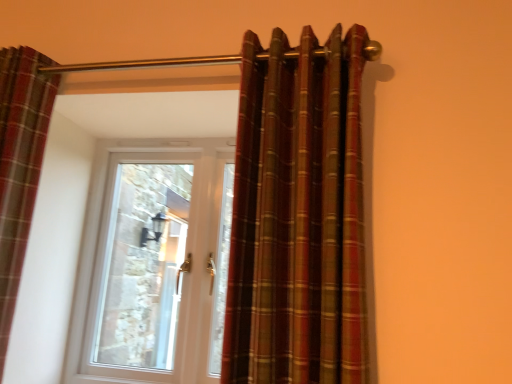
Question: Which direction should I rotate to look at plaid fabric curtain at center, the 2th curtain in the left-to-right sequence?

Choices:
 (A) left
 (B) right

Answer: (B)

Question: Is plaid fabric curtain at center, positioned as the 1th curtain in right-to-left order, aimed at plaid fabric curtain at left, which is counted as the first curtain, starting from the left?

Choices:
 (A) yes
 (B) no

Answer: (B)

Question: Considering the relative sizes of plaid fabric curtain at center, positioned as the 1th curtain in right-to-left order, and plaid fabric curtain at left, which ranks as the second curtain in right-to-left order, in the image provided, is plaid fabric curtain at center, positioned as the 1th curtain in right-to-left order, shorter than plaid fabric curtain at left, which ranks as the second curtain in right-to-left order,?

Choices:
 (A) no
 (B) yes

Answer: (B)

Question: Is plaid fabric curtain at center, the 2th curtain in the left-to-right sequence, at the right side of plaid fabric curtain at left, which ranks as the second curtain in right-to-left order?

Choices:
 (A) yes
 (B) no

Answer: (A)

Question: Does plaid fabric curtain at center, the 2th curtain in the left-to-right sequence, have a smaller size compared to plaid fabric curtain at left, which ranks as the second curtain in right-to-left order?

Choices:
 (A) yes
 (B) no

Answer: (B)

Question: Can you confirm if plaid fabric curtain at center, positioned as the 1th curtain in right-to-left order, is thinner than plaid fabric curtain at left, which ranks as the second curtain in right-to-left order?

Choices:
 (A) yes
 (B) no

Answer: (B)

Question: Does plaid fabric curtain at center, positioned as the 1th curtain in right-to-left order, have a greater height compared to plaid fabric curtain at left, which is counted as the first curtain, starting from the left?

Choices:
 (A) yes
 (B) no

Answer: (B)

Question: Considering the relative sizes of plaid fabric curtain at center, positioned as the 1th curtain in right-to-left order, and white plastic door at center in the image provided, is plaid fabric curtain at center, positioned as the 1th curtain in right-to-left order, wider than white plastic door at center?

Choices:
 (A) no
 (B) yes

Answer: (B)

Question: Does plaid fabric curtain at center, the 2th curtain in the left-to-right sequence, come behind white plastic door at center?

Choices:
 (A) no
 (B) yes

Answer: (A)

Question: From the image's perspective, is plaid fabric curtain at center, positioned as the 1th curtain in right-to-left order, beneath white plastic door at center?

Choices:
 (A) no
 (B) yes

Answer: (A)

Question: Are plaid fabric curtain at center, the 2th curtain in the left-to-right sequence, and white plastic door at center located far from each other?

Choices:
 (A) no
 (B) yes

Answer: (B)

Question: Is plaid fabric curtain at center, positioned as the 1th curtain in right-to-left order, positioned in front of white plastic door at center?

Choices:
 (A) no
 (B) yes

Answer: (B)

Question: Considering the relative sizes of plaid fabric curtain at center, positioned as the 1th curtain in right-to-left order, and white plastic door at center in the image provided, is plaid fabric curtain at center, positioned as the 1th curtain in right-to-left order, bigger than white plastic door at center?

Choices:
 (A) no
 (B) yes

Answer: (B)

Question: Does white plastic door at center appear on the left side of plaid fabric curtain at center, positioned as the 1th curtain in right-to-left order?

Choices:
 (A) no
 (B) yes

Answer: (B)